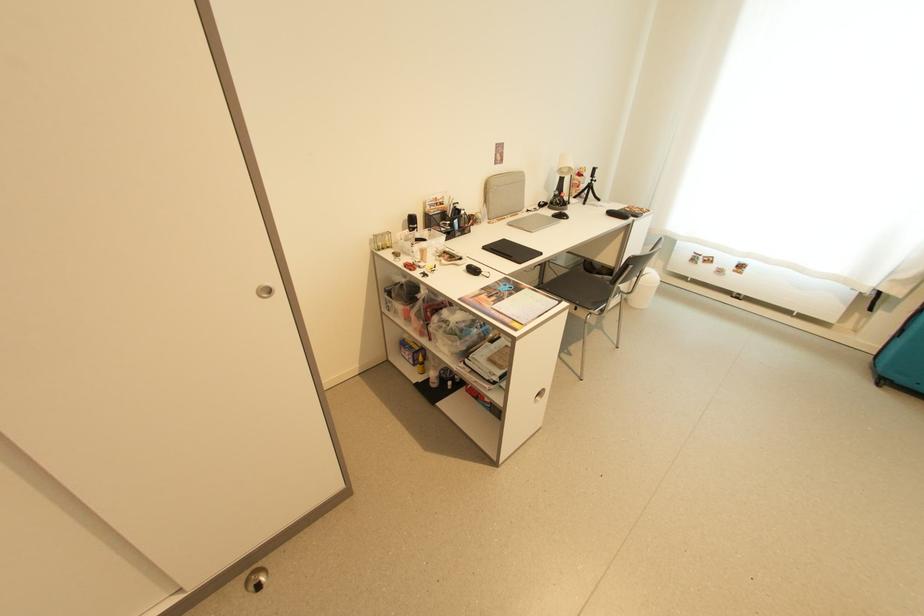
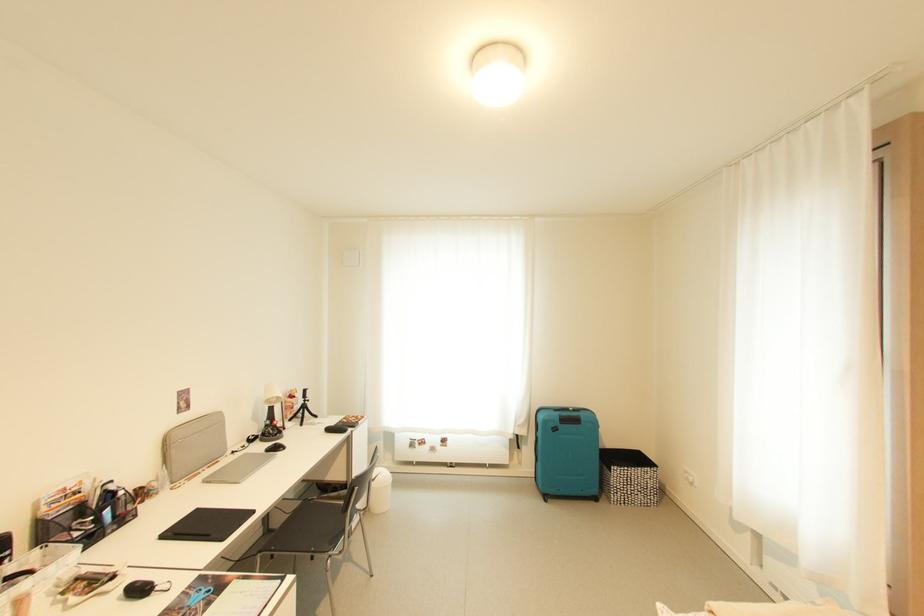
Where in the second image is the point corresponding to (633,294) from the first image?

(370, 511)